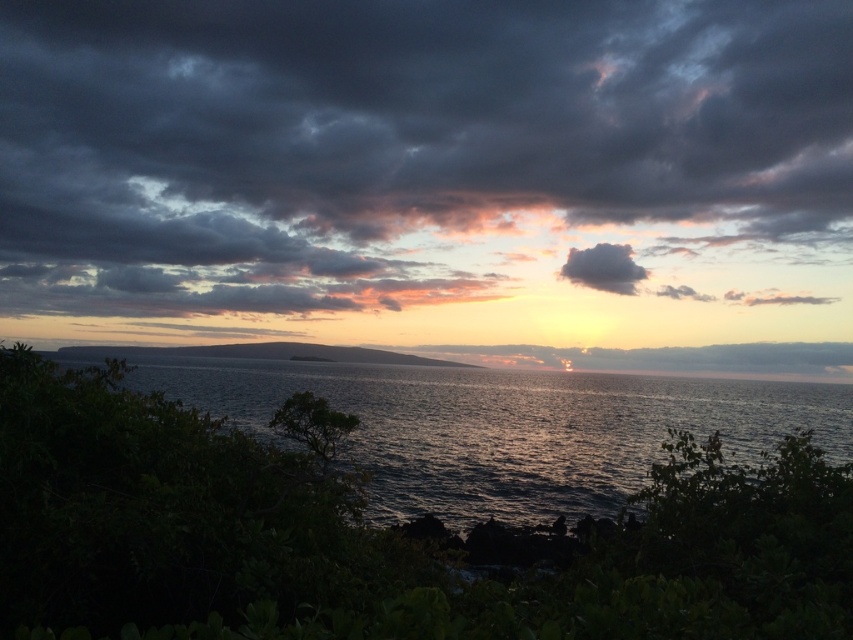
Question: Is dark gray cloud at upper center to the left of dark gray fluffy cloud at upper center from the viewer's perspective?

Choices:
 (A) no
 (B) yes

Answer: (B)

Question: Which of the following is the closest to the observer?

Choices:
 (A) (x=431, y=104)
 (B) (x=585, y=275)
 (C) (x=801, y=406)

Answer: (C)

Question: Does dark blue water at center have a larger size compared to dark gray fluffy cloud at upper center?

Choices:
 (A) no
 (B) yes

Answer: (B)

Question: Does dark blue water at center have a larger size compared to dark gray fluffy cloud at upper center?

Choices:
 (A) yes
 (B) no

Answer: (A)

Question: Which of the following is the closest to the observer?

Choices:
 (A) dark gray cloud at upper center
 (B) dark gray fluffy cloud at upper center

Answer: (A)

Question: Estimate the real-world distances between objects in this image. Which object is farther from the dark blue water at center?

Choices:
 (A) dark gray fluffy cloud at upper center
 (B) dark gray cloud at upper center

Answer: (B)